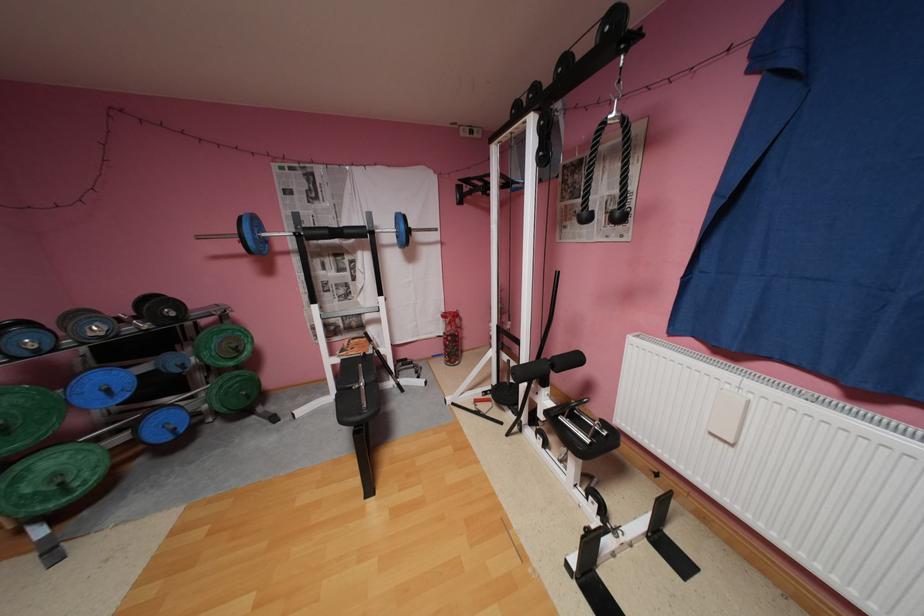
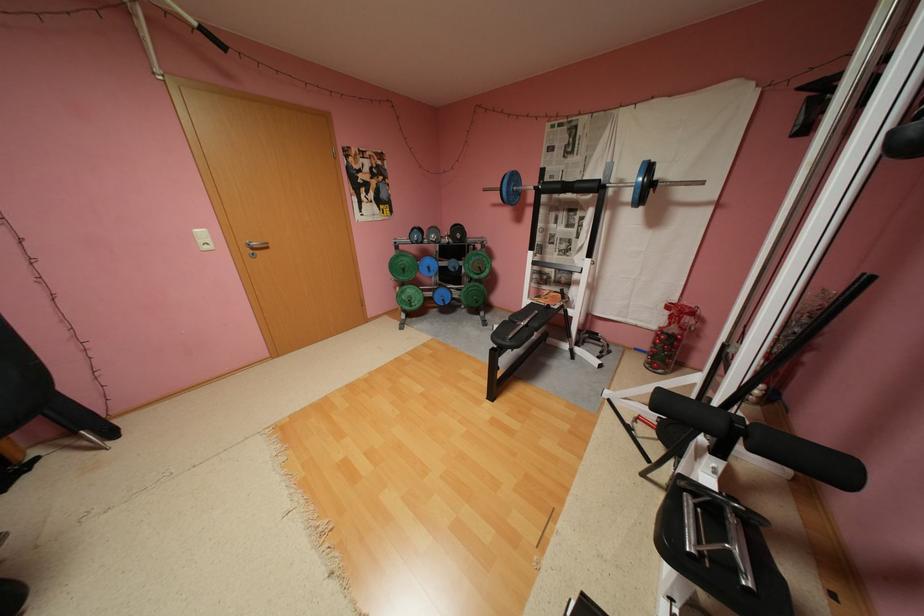
Locate, in the second image, the point that corresponds to (x=246, y=347) in the first image.

(489, 267)